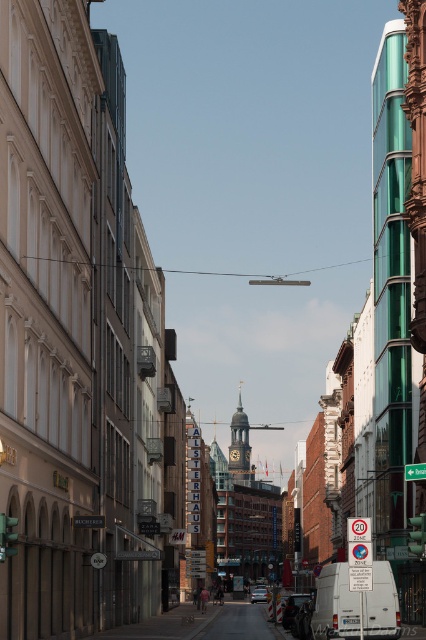
You are a delivery driver who needs to park your vehicle in a tight space between two buildings on the street. You have a metallic silver van at center and a silver metallic car at center. Which vehicle would you choose to park in the space, and why?

You should choose the metallic silver van at center because it occupies less space than the silver metallic car at center, making it easier to fit into the tight parking space between the buildings.

You are a photographer standing at the end of the street looking towards the gold textured clock tower at center and the metallic silver van at center. Which object would appear larger in your photo?

The gold textured clock tower at center would appear larger in the photo because it is much taller than the metallic silver van at center.